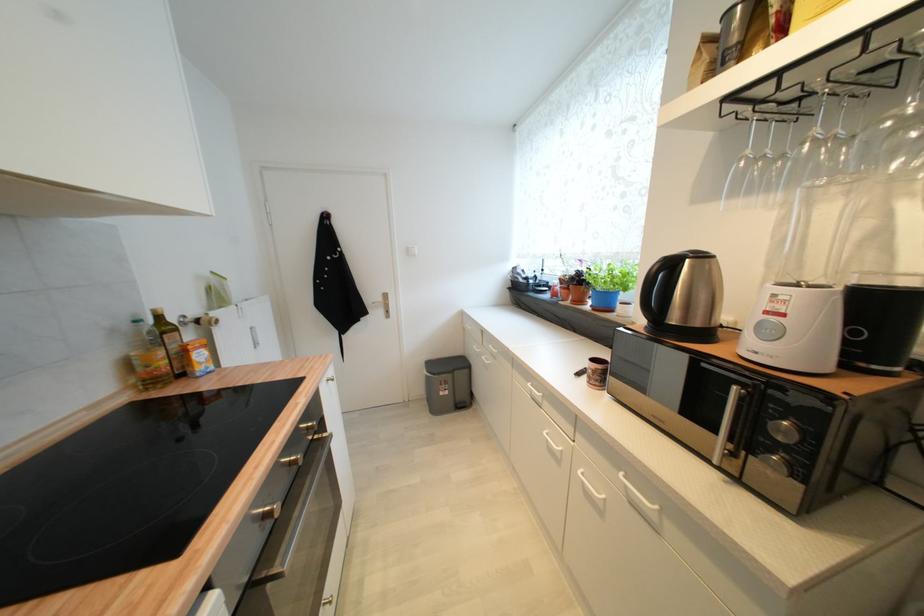
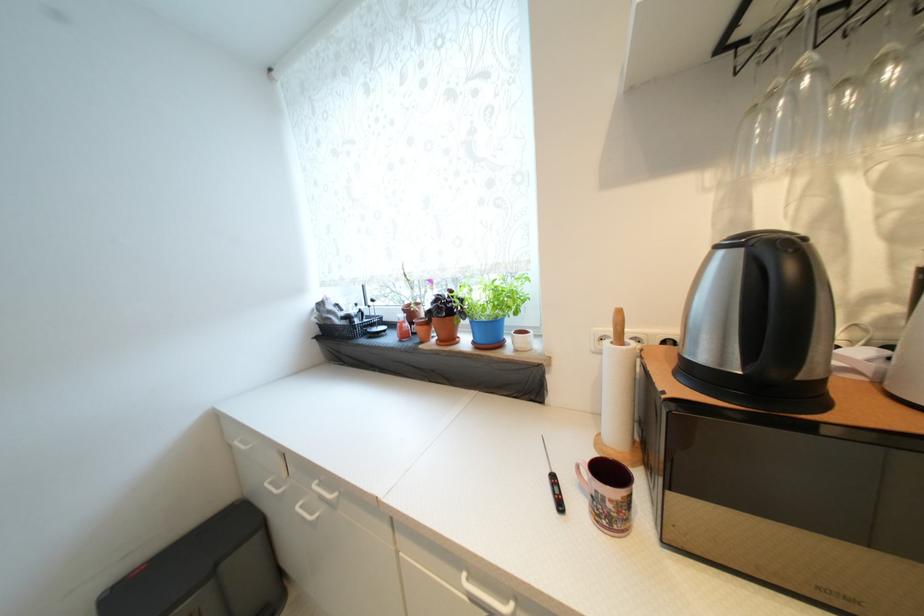
Find the pixel in the second image that matches pixel 597 307 in the first image.

(478, 344)